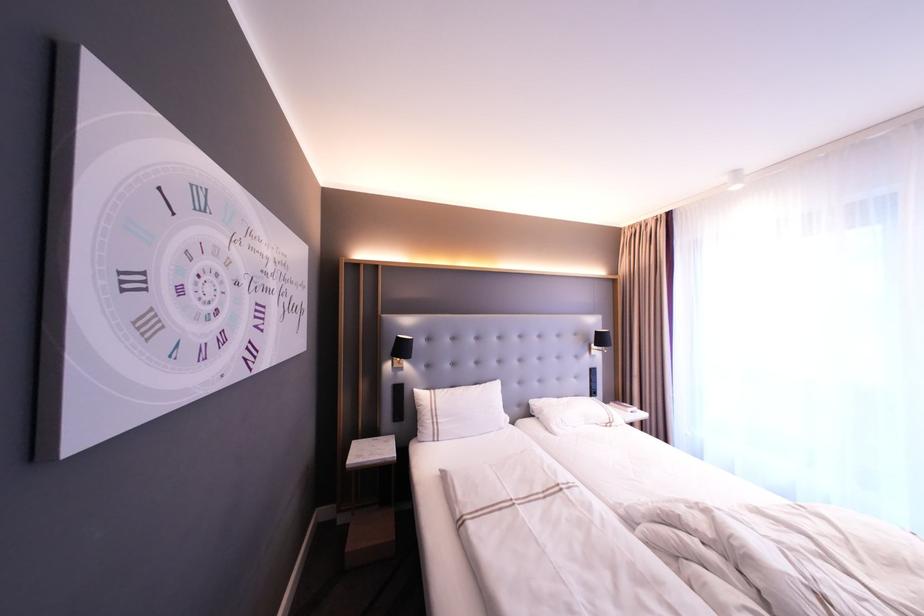
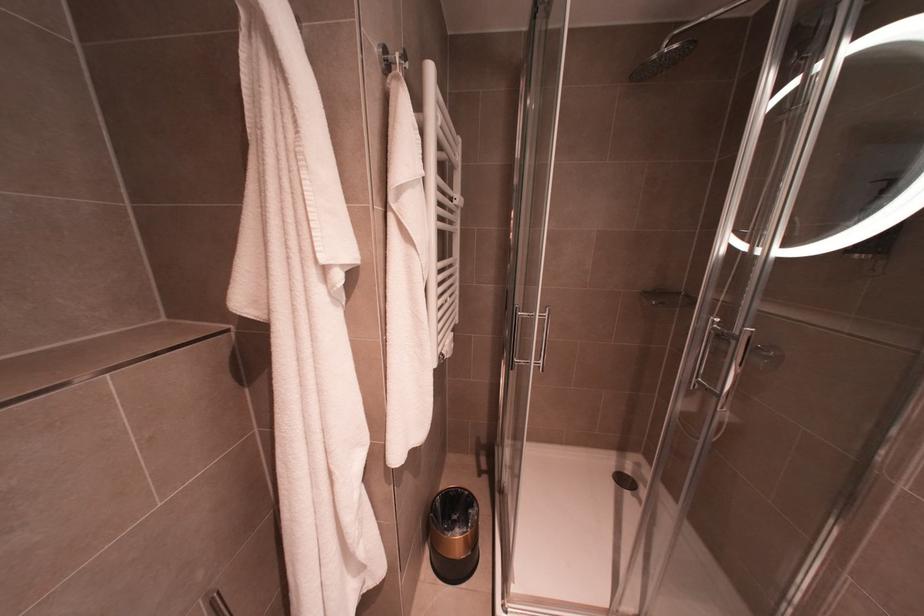
Question: Which direction would the cameraman need to move to produce the second image? Reply with the corresponding letter.

Choices:
 (A) Left
 (B) Right
 (C) Forward
 (D) Backward

Answer: (A)